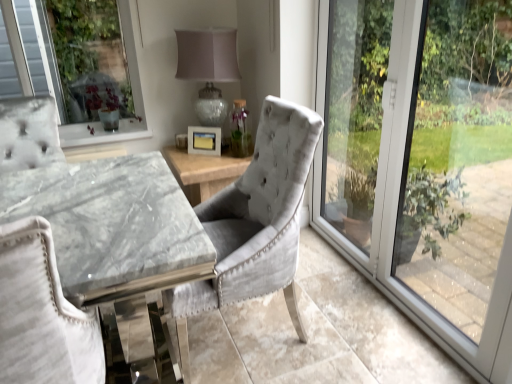
You are a GUI agent. You are given a task and a screenshot of the screen. Output one action in this format:
    pyautogui.click(x=<x>, y=<y>)
    Task: Click on the vacant space in transparent glass window at right (from a real-world perspective)
    The image size is (512, 384).
    Given the screenshot: What is the action you would take?
    pyautogui.click(x=386, y=300)